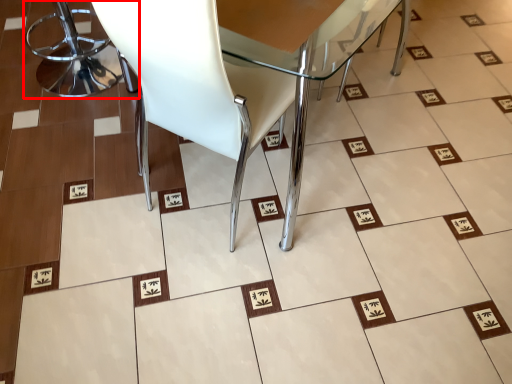
Question: From the image, what is the correct spatial relationship of chair (annotated by the red box) in relation to chair?

Choices:
 (A) left
 (B) right

Answer: (A)